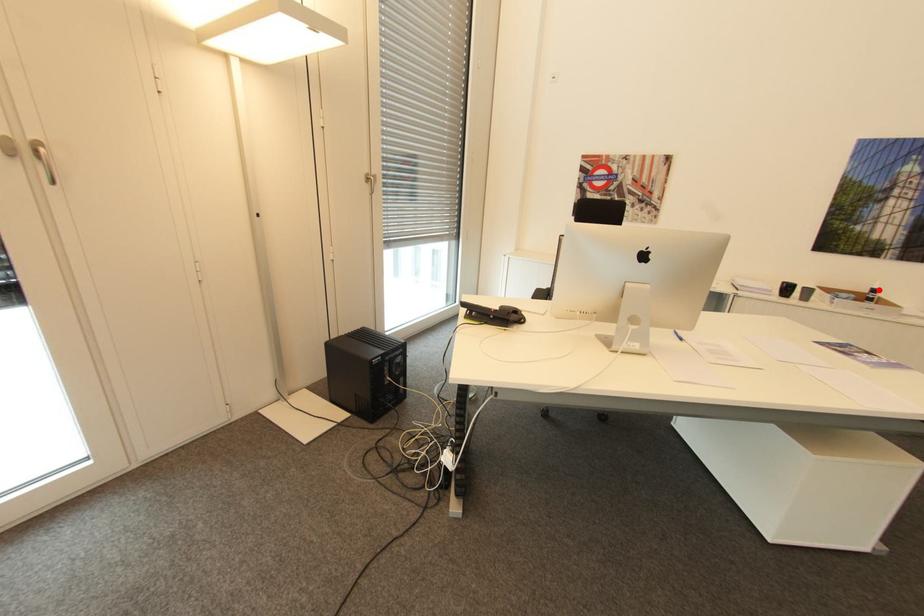
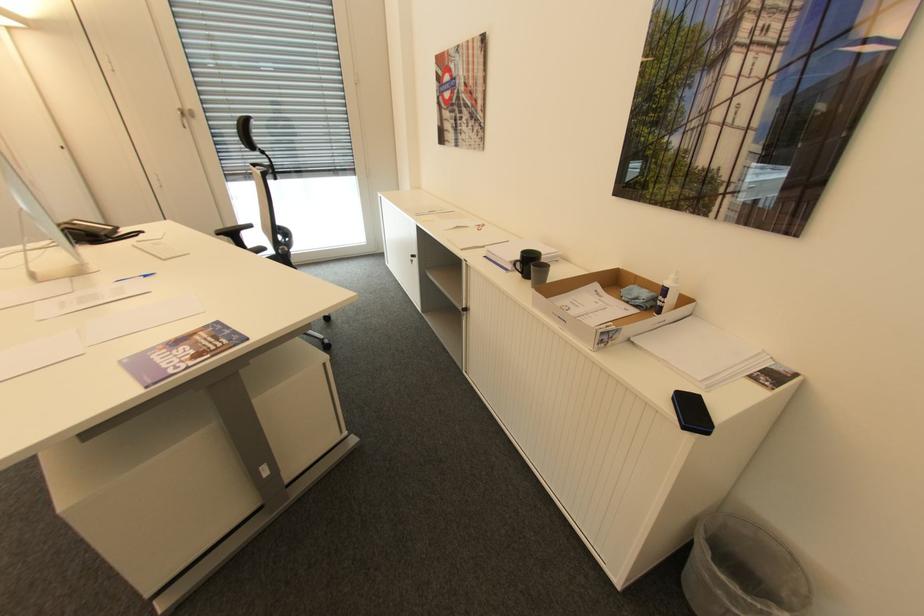
Question: I am providing you with two images of the same scene from different viewpoints. A red point is marked on the first image. Can you still see the location of the red point in image 2?

Choices:
 (A) Yes
 (B) No

Answer: (A)